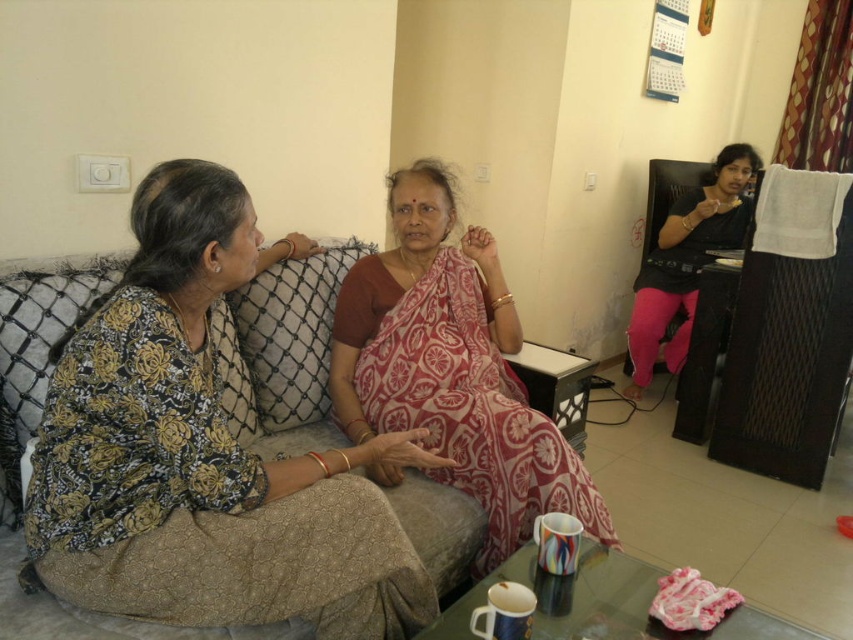
Question: Which object is closer to the camera taking this photo?

Choices:
 (A) beige fabric couch at center
 (B) red floral saree at center
 (C) black matte chair at right

Answer: (A)

Question: Does red floral saree at center appear under beige fabric couch at center?

Choices:
 (A) yes
 (B) no

Answer: (B)

Question: Which object appears farthest from the camera in this image?

Choices:
 (A) black matte chair at right
 (B) red floral saree at center

Answer: (A)

Question: Which of the following is the farthest from the observer?

Choices:
 (A) (517, 328)
 (B) (693, 278)

Answer: (B)

Question: Where is beige fabric couch at center located in relation to black matte chair at right in the image?

Choices:
 (A) below
 (B) above

Answer: (A)

Question: Is red floral saree at center positioned behind black matte chair at right?

Choices:
 (A) yes
 (B) no

Answer: (B)